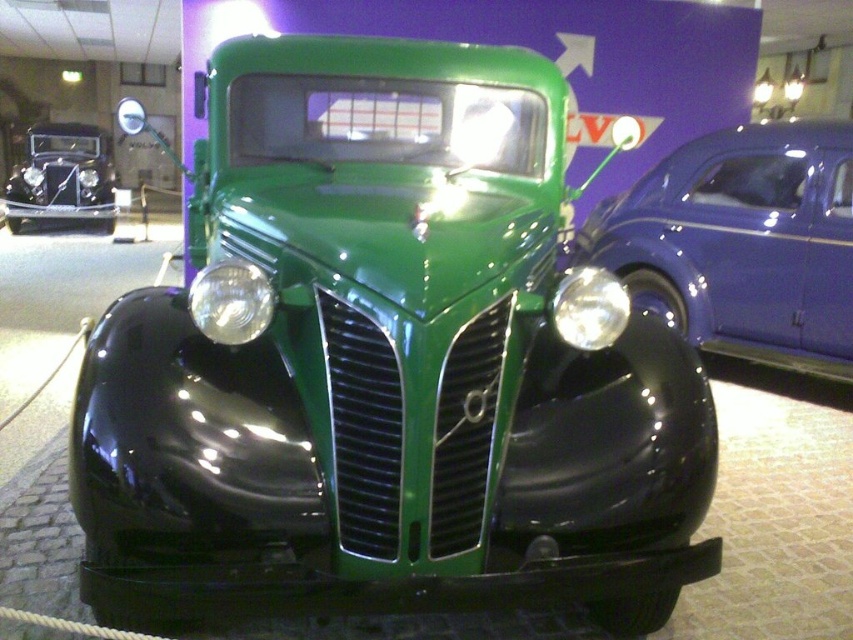
You are standing in front of the vintage green car in the museum. You notice two points marked on the car. One is at coordinate point (158, 296) and the other at point (851, 182). Which point is closer to you?

Point (158, 296) is closer to the viewer than point (851, 182).

You are a tour guide explaining the museum layout to visitors. You mention the metallic blue car at right and the matte black headlight at center. Which object is larger in size?

The metallic blue car at right is bigger than the matte black headlight at center.